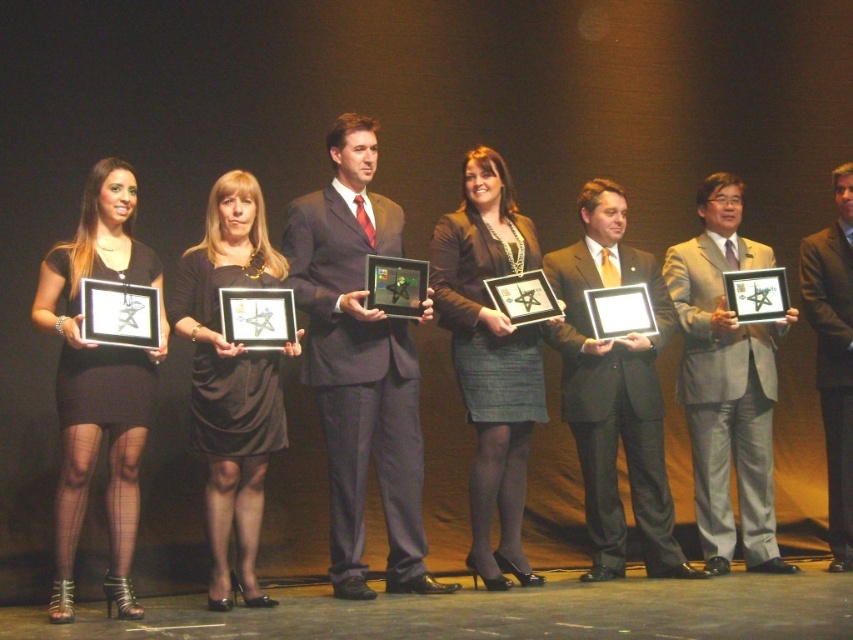
Question: Which point appears closest to the camera in this image?

Choices:
 (A) (485, 166)
 (B) (762, 538)

Answer: (A)

Question: Is matte black suit at center further to the viewer compared to black satin dress at center?

Choices:
 (A) no
 (B) yes

Answer: (B)

Question: Does matte black suit at center have a larger size compared to dark gray suit at center?

Choices:
 (A) yes
 (B) no

Answer: (A)

Question: Which object appears farthest from the camera in this image?

Choices:
 (A) dark gray suit at center
 (B) metallic silver picture frame at center

Answer: (B)

Question: Is black satin dress at center bigger than dark gray suit at center?

Choices:
 (A) no
 (B) yes

Answer: (B)

Question: Which point is closer to the camera?

Choices:
 (A) matte black suit at center
 (B) black satin dress at center
 (C) matte gray suit at center

Answer: (B)